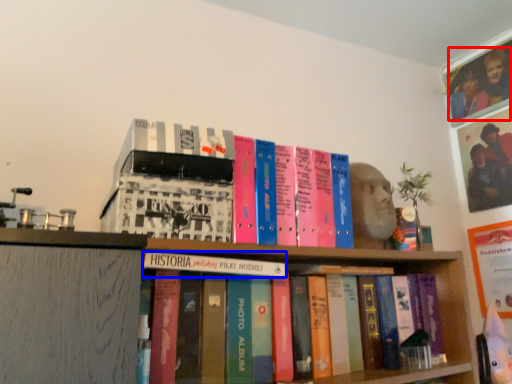
Question: Which of the following is the closest to the observer, couple (highlighted by a red box) or book (highlighted by a blue box)?

Choices:
 (A) couple
 (B) book

Answer: (B)